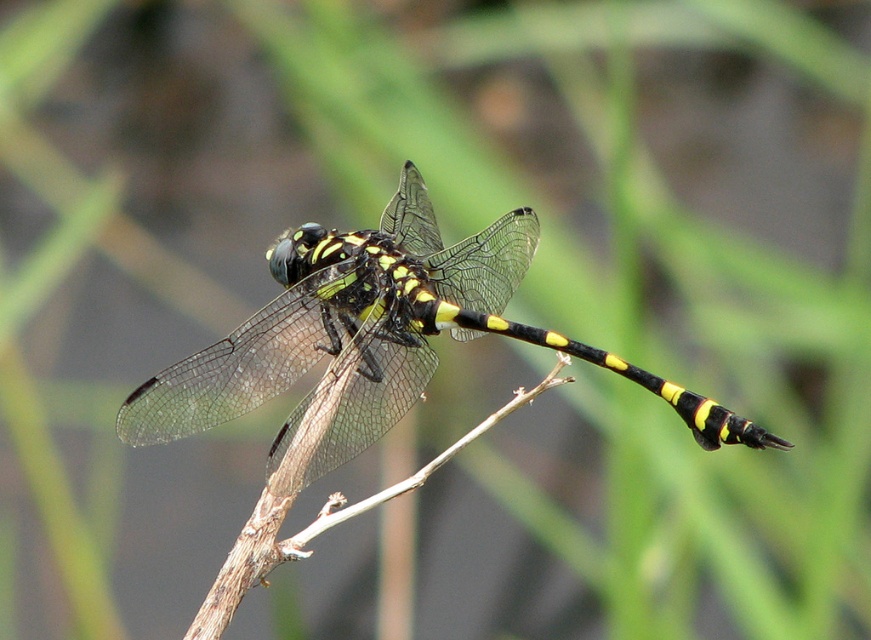
Question: Which of the following is the farthest from the observer?

Choices:
 (A) yellow-black dragonfly at center
 (B) black/yellow striped tail at center-right

Answer: (A)

Question: Is yellow-black dragonfly at center wider than black/yellow striped tail at center-right?

Choices:
 (A) no
 (B) yes

Answer: (B)

Question: Which point appears farthest from the camera in this image?

Choices:
 (A) (285, 374)
 (B) (687, 406)

Answer: (A)

Question: Is yellow-black dragonfly at center positioned behind black/yellow striped tail at center-right?

Choices:
 (A) no
 (B) yes

Answer: (B)

Question: In this image, where is yellow-black dragonfly at center located relative to black/yellow striped tail at center-right?

Choices:
 (A) right
 (B) left

Answer: (B)

Question: Which object is closer to the camera taking this photo?

Choices:
 (A) yellow-black dragonfly at center
 (B) black/yellow striped tail at center-right

Answer: (B)